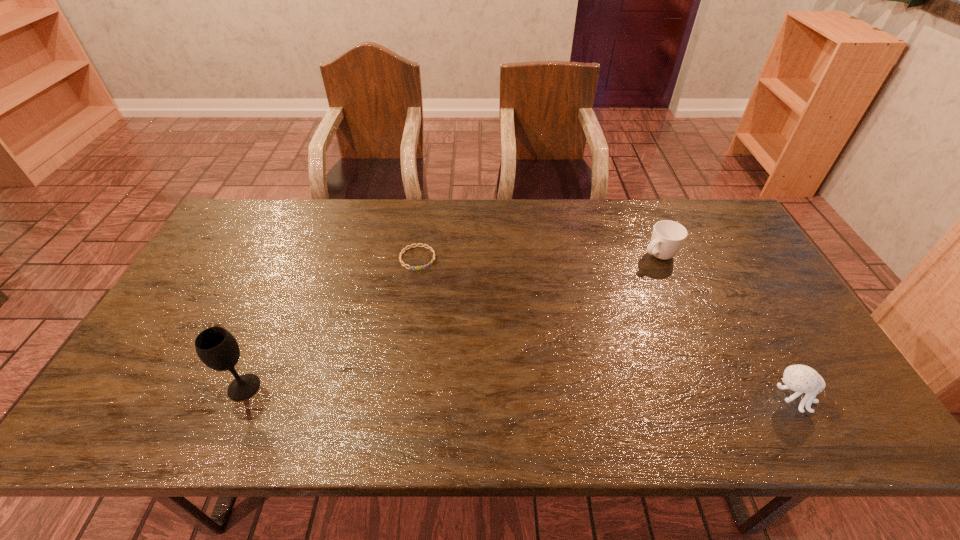
Where is `vacant space at the left edge of the desktop`? vacant space at the left edge of the desktop is located at coordinates (174, 324).

The image size is (960, 540). I want to click on free region at the right edge, so click(768, 286).

Find the location of a particular element. The width and height of the screenshot is (960, 540). vacant area at the far left corner is located at coordinates (243, 213).

This screenshot has width=960, height=540. What are the coordinates of `free space at the far right corner` in the screenshot? It's located at (720, 225).

Where is `free space between the leftmost object and the cup`? This screenshot has width=960, height=540. free space between the leftmost object and the cup is located at coordinates (451, 321).

The image size is (960, 540). I want to click on empty location between the leftmost object and the cup, so click(451, 321).

The width and height of the screenshot is (960, 540). I want to click on vacant area that lies between the octopus and the third object from right to left, so coord(605,328).

This screenshot has height=540, width=960. In order to click on free spot between the tallest object and the shortest object in this screenshot , I will do `click(331, 322)`.

Where is `vacant space that's between the octopus and the cup`? vacant space that's between the octopus and the cup is located at coordinates [725, 327].

At what (x,y) coordinates should I click in order to perform the action: click on vacant space that is in between the second object from left to right and the wineglass. Please return your answer as a coordinate pair (x, y). Looking at the image, I should click on (331, 322).